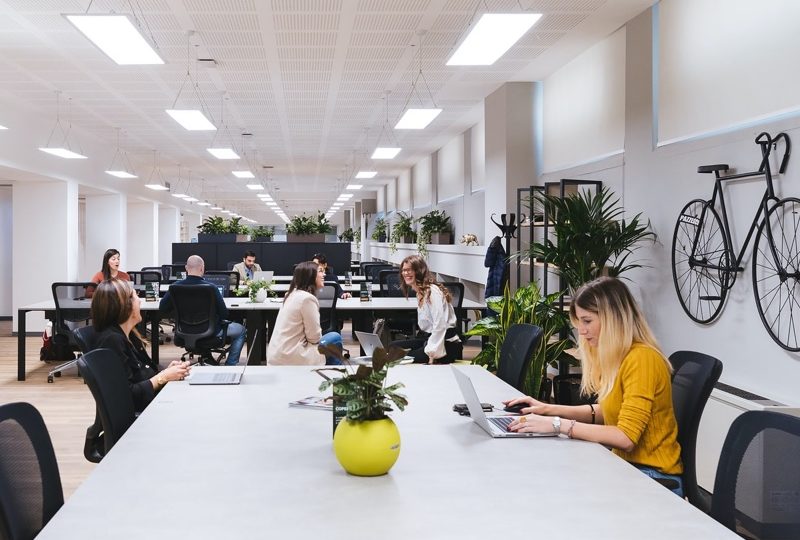
This screenshot has width=800, height=540. In order to click on chairs on right side of second table in this screenshot , I will do `click(69, 322)`, `click(190, 316)`, `click(326, 312)`, `click(454, 294)`.